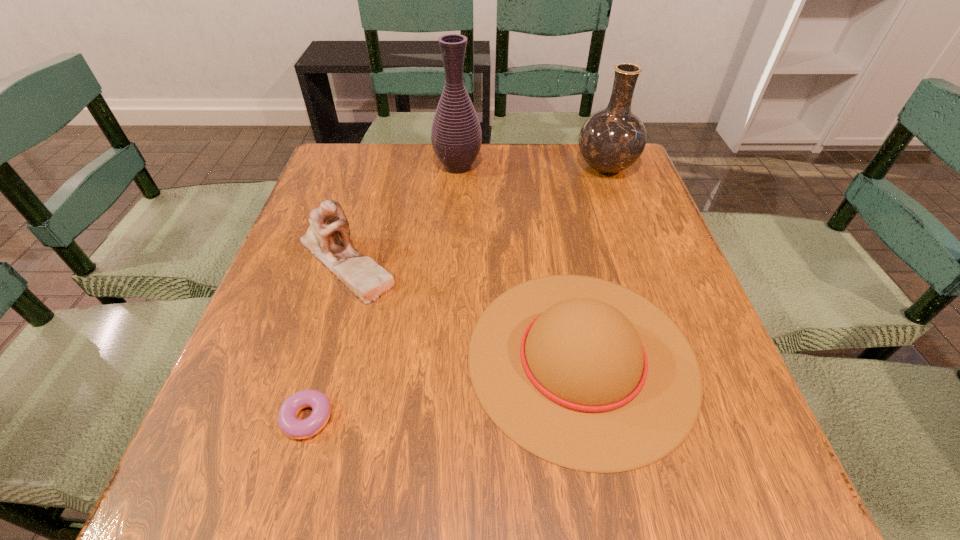
Find the location of a particular element. vacant area situated on the right of the fourth tallest object is located at coordinates (724, 357).

You are a GUI agent. You are given a task and a screenshot of the screen. Output one action in this format:
    pyautogui.click(x=<x>, y=<y>)
    Task: Click on the free space located 0.120m on the back of the doughnut
    
    Given the screenshot: What is the action you would take?
    pyautogui.click(x=331, y=336)

This screenshot has height=540, width=960. I want to click on sombrero that is at the near edge, so click(x=584, y=373).

Find the location of a particular element. doughnut that is at the near edge is located at coordinates (291, 426).

Find the location of a particular element. Image resolution: width=960 pixels, height=540 pixels. figurine at the left edge is located at coordinates (327, 238).

This screenshot has height=540, width=960. I want to click on doughnut that is at the left edge, so click(291, 426).

Identify the location of vase present at the right edge. The height and width of the screenshot is (540, 960). (611, 140).

Identify the location of sombrero situated at the right edge. [x=584, y=373].

Where is `object that is at the near left corner`? Image resolution: width=960 pixels, height=540 pixels. object that is at the near left corner is located at coordinates (291, 426).

At what (x,y) coordinates should I click in order to perform the action: click on object that is at the far right corner. Please return your answer as a coordinate pair (x, y). The height and width of the screenshot is (540, 960). Looking at the image, I should click on (611, 140).